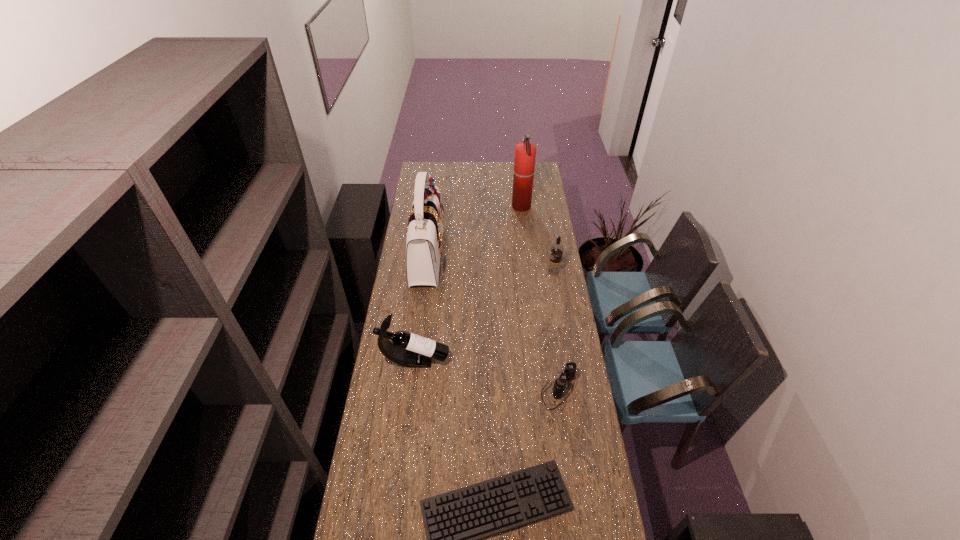
This screenshot has width=960, height=540. In order to click on vacant space located on the front-facing side of the satchel in this screenshot , I will do 469,256.

Locate an element on the screen. The width and height of the screenshot is (960, 540). vacant space located 0.340m on the stand of the wine bottle is located at coordinates (531, 361).

Locate an element on the screen. This screenshot has width=960, height=540. free location located on the label of the fourth tallest object is located at coordinates (477, 272).

Find the location of a particular element. free space located on the label of the fourth tallest object is located at coordinates (513, 272).

Where is `vacant space located 0.060m on the label of the fourth tallest object`? vacant space located 0.060m on the label of the fourth tallest object is located at coordinates (535, 272).

In order to click on vacant area situated on the back of the binoculars in this screenshot , I will do `click(553, 349)`.

The width and height of the screenshot is (960, 540). I want to click on satchel located in the left edge section of the desktop, so click(424, 234).

Locate an element on the screen. The width and height of the screenshot is (960, 540). wine bottle present at the left edge is located at coordinates (410, 350).

Where is `fire extinguisher at the right edge`? The height and width of the screenshot is (540, 960). fire extinguisher at the right edge is located at coordinates (525, 152).

At what (x,y) coordinates should I click in order to perform the action: click on vodka located in the right edge section of the desktop. Please return your answer as a coordinate pair (x, y). Looking at the image, I should click on (554, 267).